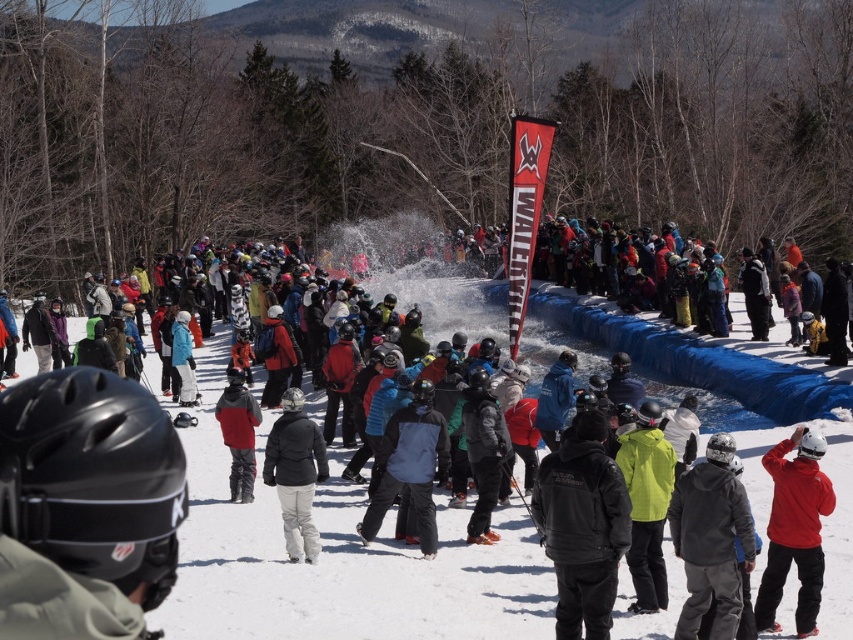
You are a photographer standing at the camera position. You want to capture a closeup shot of the red matte jacket at center. Given that your camera can focus on subjects within 40 feet, will you be able to take the photo without moving closer?

The red matte jacket at center is 41.31 feet from the camera, which is beyond the camera focus range of 40 feet. Therefore, you cannot take the closeup shot without moving closer.

You are a photographer trying to capture both the black leather jacket at center and the red jacket at center in a single frame. Based on their sizes, which jacket will appear larger in the photo?

The red jacket at center will appear larger in the photo since it has a bigger size compared to the black leather jacket at center.